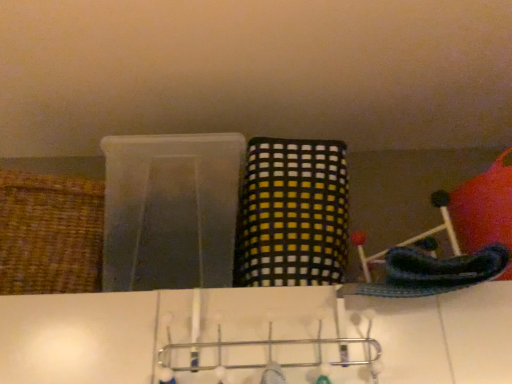
Question: Is yellow checkered fabric basket at center, which is the first basket in right-to-left order, positioned in front of woven brown basket at left, which ranks as the 1th basket in left-to-right order?

Choices:
 (A) no
 (B) yes

Answer: (A)

Question: From a real-world perspective, is yellow checkered fabric basket at center, which is the first basket in right-to-left order, beneath woven brown basket at left, which ranks as the second basket in right-to-left order?

Choices:
 (A) yes
 (B) no

Answer: (B)

Question: From the image's perspective, is yellow checkered fabric basket at center, which is the first basket in right-to-left order, under woven brown basket at left, which ranks as the 1th basket in left-to-right order?

Choices:
 (A) yes
 (B) no

Answer: (B)

Question: Is yellow checkered fabric basket at center, which is the first basket in right-to-left order, not within woven brown basket at left, which ranks as the second basket in right-to-left order?

Choices:
 (A) no
 (B) yes

Answer: (B)

Question: Is yellow checkered fabric basket at center, which appears as the 2th basket when viewed from the left, positioned with its back to woven brown basket at left, which ranks as the second basket in right-to-left order?

Choices:
 (A) yes
 (B) no

Answer: (B)

Question: Considering the positions of metallic silver hanger at center and yellow checkered fabric basket at center, which appears as the 2th basket when viewed from the left, in the image, is metallic silver hanger at center bigger or smaller than yellow checkered fabric basket at center, which appears as the 2th basket when viewed from the left,?

Choices:
 (A) big
 (B) small

Answer: (B)

Question: In terms of width, does metallic silver hanger at center look wider or thinner when compared to yellow checkered fabric basket at center, which appears as the 2th basket when viewed from the left?

Choices:
 (A) thin
 (B) wide

Answer: (A)

Question: From the image's perspective, is metallic silver hanger at center above or below yellow checkered fabric basket at center, which appears as the 2th basket when viewed from the left?

Choices:
 (A) below
 (B) above

Answer: (A)

Question: Is metallic silver hanger at center spatially inside yellow checkered fabric basket at center, which is the first basket in right-to-left order, or outside of it?

Choices:
 (A) outside
 (B) inside

Answer: (A)

Question: Based on their positions, is yellow checkered fabric basket at center, which is the first basket in right-to-left order, located to the left or right of metallic silver hanger at center?

Choices:
 (A) left
 (B) right

Answer: (B)

Question: Is yellow checkered fabric basket at center, which is the first basket in right-to-left order, spatially inside metallic silver hanger at center, or outside of it?

Choices:
 (A) outside
 (B) inside

Answer: (A)

Question: Looking at the image, does yellow checkered fabric basket at center, which appears as the 2th basket when viewed from the left, seem bigger or smaller compared to metallic silver hanger at center?

Choices:
 (A) big
 (B) small

Answer: (A)

Question: From the image's perspective, is yellow checkered fabric basket at center, which is the first basket in right-to-left order, located above or below metallic silver hanger at center?

Choices:
 (A) above
 (B) below

Answer: (A)

Question: Considering the relative positions of metallic silver hanger at center and woven brown basket at left, which ranks as the 1th basket in left-to-right order, in the image provided, is metallic silver hanger at center to the left or to the right of woven brown basket at left, which ranks as the 1th basket in left-to-right order,?

Choices:
 (A) left
 (B) right

Answer: (B)

Question: From their relative heights in the image, would you say metallic silver hanger at center is taller or shorter than woven brown basket at left, which ranks as the 1th basket in left-to-right order?

Choices:
 (A) tall
 (B) short

Answer: (B)